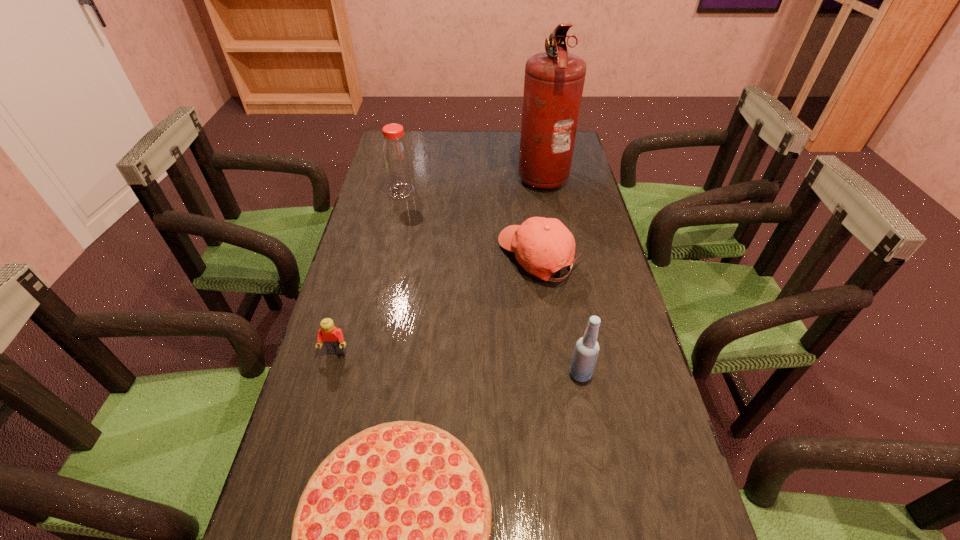
Locate an element on the screen. The height and width of the screenshot is (540, 960). blank region between the tallest object and the left bottle is located at coordinates (472, 183).

Identify the location of free space between the right bottle and the fourth nearest object. The image size is (960, 540). (559, 315).

Locate which object ranks in proximity to the fifth shortest object. Please provide its 2D coordinates. Your answer should be formatted as a tuple, i.e. [(x, y)], where the tuple contains the x and y coordinates of a point satisfying the conditions above.

[(542, 246)]

This screenshot has width=960, height=540. Find the location of `object that is the nearest to the tallest object`. object that is the nearest to the tallest object is located at coordinates [542, 246].

What are the coordinates of `vacant area that satisfies the following two spatial constraints: 1. at the front of the nearer bottle where the nozzle is aimed; 2. on the left side of the fire extinguisher` in the screenshot? It's located at (579, 374).

This screenshot has width=960, height=540. Find the location of `vacant area that satisfies the following two spatial constraints: 1. on the front side of the fourth nearest object; 2. on the left side of the taller bottle`. vacant area that satisfies the following two spatial constraints: 1. on the front side of the fourth nearest object; 2. on the left side of the taller bottle is located at coordinates (387, 257).

The height and width of the screenshot is (540, 960). I want to click on vacant space that satisfies the following two spatial constraints: 1. at the front of the right bottle where the nozzle is aimed; 2. on the left side of the tallest object, so click(579, 374).

I want to click on free space that satisfies the following two spatial constraints: 1. at the front of the tallest object where the nozzle is aimed; 2. on the back side of the nearer bottle, so click(x=579, y=374).